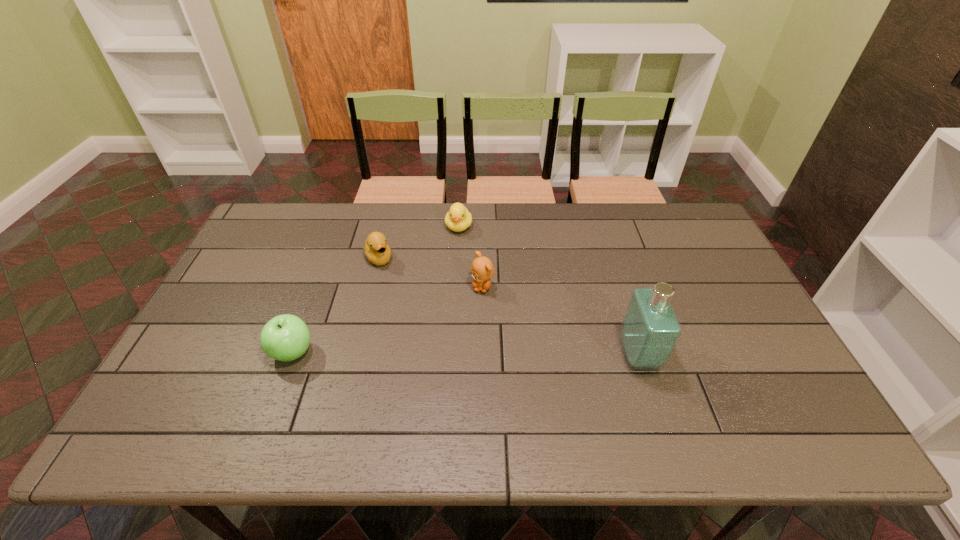
Identify the location of the leftmost object. The image size is (960, 540). (286, 337).

Image resolution: width=960 pixels, height=540 pixels. Identify the location of the tallest object. (650, 330).

Image resolution: width=960 pixels, height=540 pixels. I want to click on the rightmost object, so click(x=650, y=330).

I want to click on the right duckling, so click(458, 219).

At what (x,y) coordinates should I click in order to perform the action: click on the farthest object. Please return your answer as a coordinate pair (x, y). Looking at the image, I should click on (458, 219).

Where is `the third nearest object`? This screenshot has width=960, height=540. the third nearest object is located at coordinates (482, 269).

Where is `the left duckling`? This screenshot has width=960, height=540. the left duckling is located at coordinates (378, 252).

Locate an element on the screen. This screenshot has height=540, width=960. the fourth nearest object is located at coordinates (378, 252).

Where is `vacant region located on the back of the apple`? Image resolution: width=960 pixels, height=540 pixels. vacant region located on the back of the apple is located at coordinates (327, 258).

Where is `vacant space located 0.160m on the front label of the perfume`? The height and width of the screenshot is (540, 960). vacant space located 0.160m on the front label of the perfume is located at coordinates (718, 355).